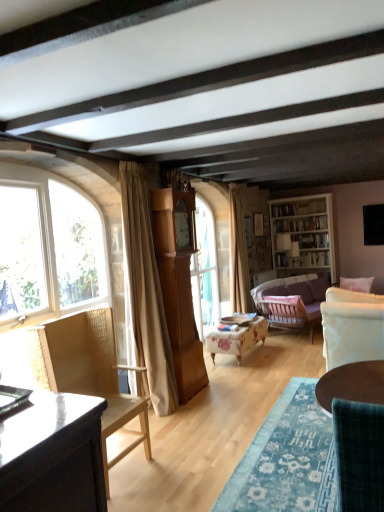
Where is `unoccupied region to the right of beige fabric curtain at left, the 1th curtain from the left`? This screenshot has height=512, width=384. unoccupied region to the right of beige fabric curtain at left, the 1th curtain from the left is located at coordinates (196, 408).